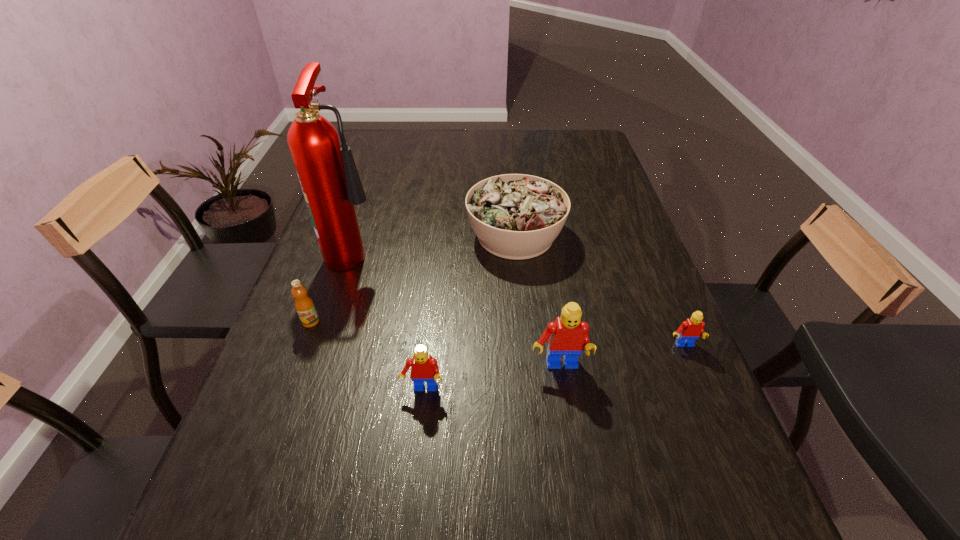
I want to click on free point that keeps the Legos evenly spaced on the left, so click(274, 415).